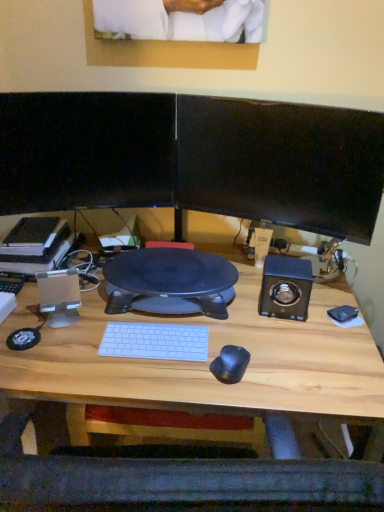
Question: Can you confirm if black glossy monitor at upper left, positioned as the first computer monitor in left-to-right order, is bigger than wooden desk at center?

Choices:
 (A) yes
 (B) no

Answer: (B)

Question: Does black glossy monitor at upper left, positioned as the first computer monitor in left-to-right order, contain wooden desk at center?

Choices:
 (A) yes
 (B) no

Answer: (B)

Question: Is black glossy monitor at upper left, positioned as the first computer monitor in left-to-right order, thinner than wooden desk at center?

Choices:
 (A) yes
 (B) no

Answer: (A)

Question: Can you confirm if black glossy monitor at upper left, positioned as the first computer monitor in left-to-right order, is taller than wooden desk at center?

Choices:
 (A) yes
 (B) no

Answer: (B)

Question: From the image's perspective, is black glossy monitor at upper left, positioned as the first computer monitor in left-to-right order, located beneath wooden desk at center?

Choices:
 (A) yes
 (B) no

Answer: (B)

Question: From a real-world perspective, is black glossy monitor at upper left, which is the 2th computer monitor from right to left, physically above wooden desk at center?

Choices:
 (A) no
 (B) yes

Answer: (B)

Question: Does black glossy monitor at upper left, which is the 2th computer monitor from right to left, have a greater width compared to black glossy monitor at upper right, which appears as the 1th computer monitor when viewed from the right?

Choices:
 (A) yes
 (B) no

Answer: (B)

Question: From the image's perspective, is black glossy monitor at upper left, positioned as the first computer monitor in left-to-right order, beneath black glossy monitor at upper right, which is the second computer monitor from left to right?

Choices:
 (A) yes
 (B) no

Answer: (B)

Question: Is the position of black glossy monitor at upper left, positioned as the first computer monitor in left-to-right order, less distant than that of black glossy monitor at upper right, which appears as the 1th computer monitor when viewed from the right?

Choices:
 (A) no
 (B) yes

Answer: (A)

Question: From a real-world perspective, is black glossy monitor at upper left, which is the 2th computer monitor from right to left, positioned under black glossy monitor at upper right, which is the second computer monitor from left to right, based on gravity?

Choices:
 (A) no
 (B) yes

Answer: (B)

Question: From a real-world perspective, is black glossy monitor at upper left, positioned as the first computer monitor in left-to-right order, on top of black glossy monitor at upper right, which appears as the 1th computer monitor when viewed from the right?

Choices:
 (A) yes
 (B) no

Answer: (B)

Question: Is black glossy monitor at upper right, which appears as the 1th computer monitor when viewed from the right, located within black glossy monitor at upper left, which is the 2th computer monitor from right to left?

Choices:
 (A) yes
 (B) no

Answer: (B)

Question: Is wooden desk at center outside black glossy monitor at upper left, positioned as the first computer monitor in left-to-right order?

Choices:
 (A) no
 (B) yes

Answer: (B)